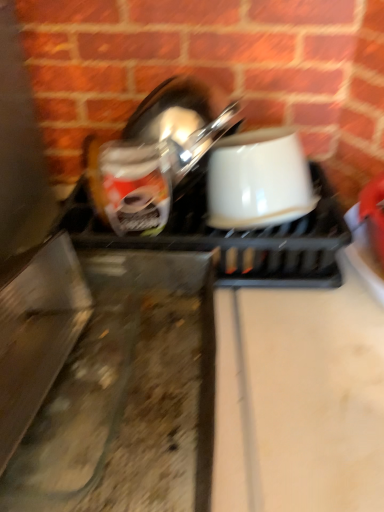
Question: From the image's perspective, is white glossy bowl at center on white glossy coffee cup at center?

Choices:
 (A) no
 (B) yes

Answer: (A)

Question: Considering the relative sizes of white glossy bowl at center and white glossy coffee cup at center in the image provided, is white glossy bowl at center bigger than white glossy coffee cup at center?

Choices:
 (A) yes
 (B) no

Answer: (A)

Question: Can you confirm if white glossy bowl at center is positioned to the left of white glossy coffee cup at center?

Choices:
 (A) no
 (B) yes

Answer: (B)

Question: Is white glossy bowl at center turned away from white glossy coffee cup at center?

Choices:
 (A) yes
 (B) no

Answer: (A)

Question: Is white glossy bowl at center aimed at white glossy coffee cup at center?

Choices:
 (A) yes
 (B) no

Answer: (A)

Question: Is white glossy bowl at center located outside white glossy coffee cup at center?

Choices:
 (A) no
 (B) yes

Answer: (B)

Question: Is white glossy coffee cup at center to the right of white glossy bowl at center from the viewer's perspective?

Choices:
 (A) yes
 (B) no

Answer: (A)

Question: Is white glossy bowl at center surrounded by white glossy coffee cup at center?

Choices:
 (A) no
 (B) yes

Answer: (A)

Question: Is white glossy coffee cup at center bigger than white glossy bowl at center?

Choices:
 (A) yes
 (B) no

Answer: (B)

Question: From a real-world perspective, is white glossy coffee cup at center located beneath white glossy bowl at center?

Choices:
 (A) yes
 (B) no

Answer: (B)

Question: Does white glossy coffee cup at center have a lesser height compared to white glossy bowl at center?

Choices:
 (A) yes
 (B) no

Answer: (B)

Question: Can you confirm if white glossy coffee cup at center is smaller than white glossy bowl at center?

Choices:
 (A) no
 (B) yes

Answer: (B)

Question: Visually, is white glossy coffee cup at center positioned to the left or to the right of white glossy bowl at center?

Choices:
 (A) left
 (B) right

Answer: (B)